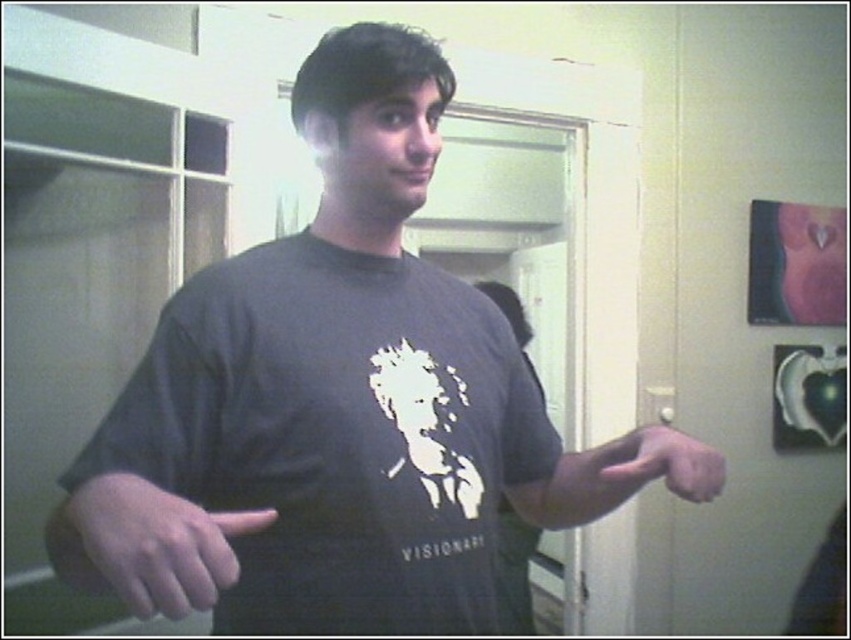
You are taking a photo of the scene and want to focus on both the point at coordinates point (143, 556) and point (634, 480). Which point should you focus on first to ensure both are in sharp focus?

You should focus on point (143, 556) first because it is closer to the camera than point (634, 480). This ensures that both points will be in sharp focus when using the camera.